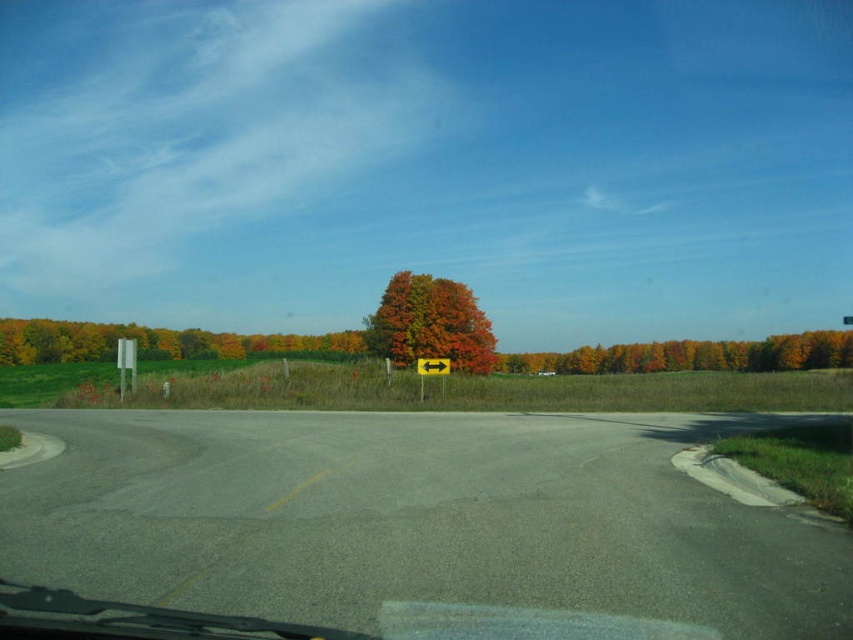
You are standing on the road and see the orange matte tree at center. If you walk straight ahead, will you eventually see the tree in front of you?

Yes, because the orange matte tree at center is located at point (693, 355), which is along the path you are walking on.

You are a pedestrian standing on the rural road and want to walk from point (287, 342) to point (519, 372). Which direction should you face to move towards the point that is farther away from you?

You should face towards point (519, 372) because it is farther away from you than point (287, 342).